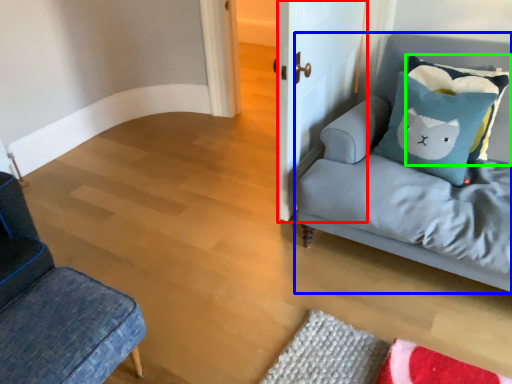
Question: Estimate the real-world distances between objects in this image. Which object is closer to door (highlighted by a red box), studio couch (highlighted by a blue box) or pillow (highlighted by a green box)?

Choices:
 (A) studio couch
 (B) pillow

Answer: (A)